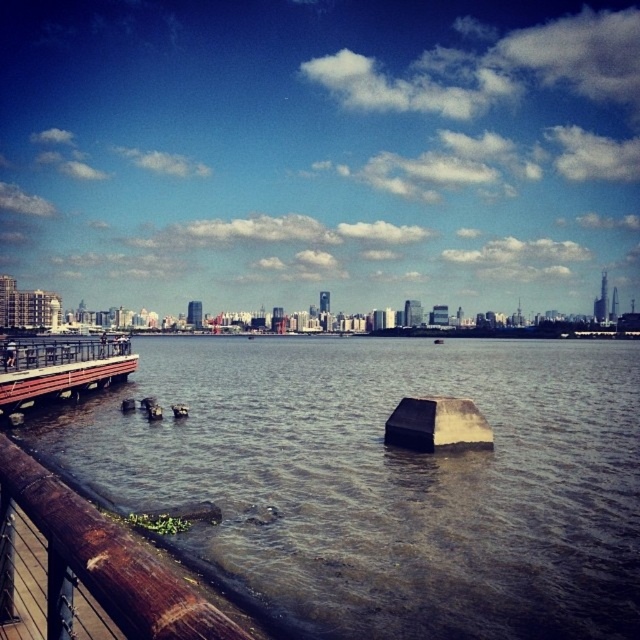
Based on the photo, can you confirm if brown wooden dock at lower left is bigger than brown wooden rail at lower left?

Correct, brown wooden dock at lower left is larger in size than brown wooden rail at lower left.

Based on the photo, can you confirm if brown wooden dock at lower left is thinner than brown wooden rail at lower left?

No, brown wooden dock at lower left is not thinner than brown wooden rail at lower left.

From the picture: Who is more forward, (115, 444) or (211, 628)?

Positioned in front is point (211, 628).

The image size is (640, 640). I want to click on brown wooden dock at lower left, so click(x=385, y=481).

Does brown wooden rail at lower left appear over black matte stone at center?

Actually, brown wooden rail at lower left is below black matte stone at center.

Does point (241, 627) lie behind point (413, 403)?

No, it is not.

The image size is (640, 640). Describe the element at coordinates (104, 561) in the screenshot. I see `brown wooden rail at lower left` at that location.

You are a GUI agent. You are given a task and a screenshot of the screen. Output one action in this format:
    pyautogui.click(x=<x>, y=<y>)
    Task: Click on the brown wooden rail at lower left
    The width and height of the screenshot is (640, 640).
    Given the screenshot: What is the action you would take?
    pyautogui.click(x=104, y=561)

Can you confirm if wooden dock at lower left is wider than black matte stone at center?

Indeed, wooden dock at lower left has a greater width compared to black matte stone at center.

Does point (100, 365) lie in front of point (429, 403)?

No.

Identify the location of wooden dock at lower left. This screenshot has width=640, height=640. 60,365.